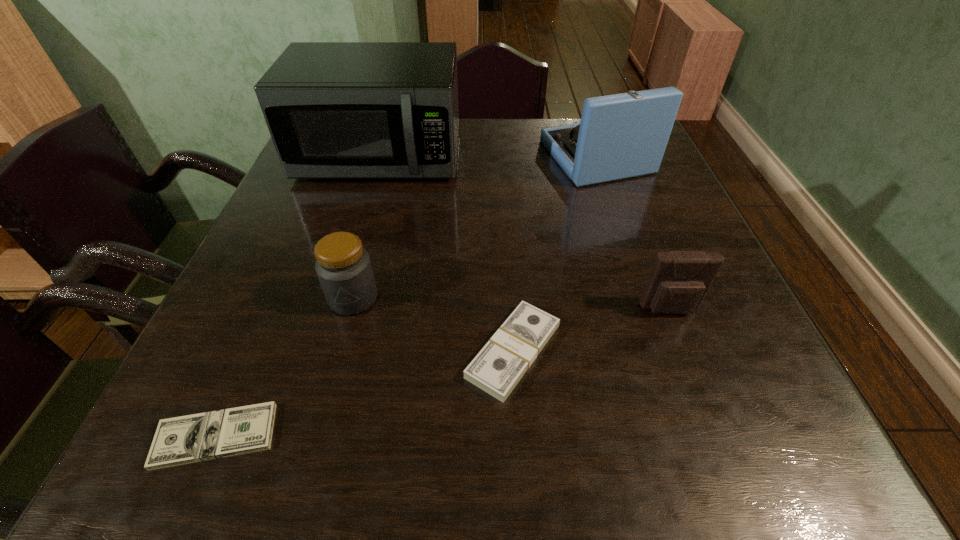
The width and height of the screenshot is (960, 540). I want to click on pouch that is at the right edge, so click(x=679, y=281).

The height and width of the screenshot is (540, 960). Find the location of `object that is at the far left corner`. object that is at the far left corner is located at coordinates (335, 110).

Identify the location of object at the near left corner. The image size is (960, 540). point(193,438).

This screenshot has height=540, width=960. I want to click on object positioned at the far right corner, so click(620, 136).

This screenshot has height=540, width=960. I want to click on vacant space at the far edge, so [x=500, y=143].

Image resolution: width=960 pixels, height=540 pixels. I want to click on free space at the left edge of the desktop, so click(292, 228).

In the image, there is a desktop. Where is `vacant region at the right edge`? vacant region at the right edge is located at coordinates (642, 226).

In the image, there is a desktop. Where is `vacant area at the near left corner`? The height and width of the screenshot is (540, 960). vacant area at the near left corner is located at coordinates (216, 461).

Where is `free space between the jar and the pouch`? free space between the jar and the pouch is located at coordinates pyautogui.click(x=512, y=304).

You are a GUI agent. You are given a task and a screenshot of the screen. Output one action in this format:
    pyautogui.click(x=<x>, y=<y>)
    Task: Click on the vacant area between the pouch and the jar
    Image resolution: width=960 pixels, height=540 pixels.
    Given the screenshot: What is the action you would take?
    pyautogui.click(x=512, y=304)